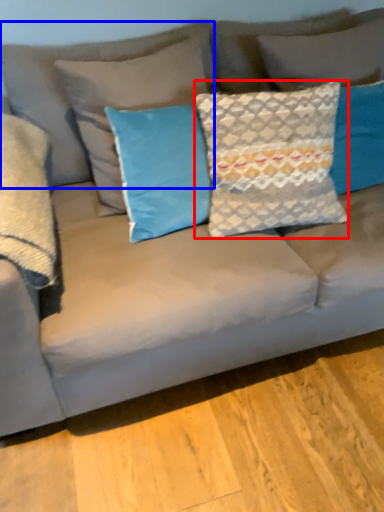
Question: Which point is further to the camera, pillow (highlighted by a red box) or pillow (highlighted by a blue box)?

Choices:
 (A) pillow
 (B) pillow

Answer: (B)